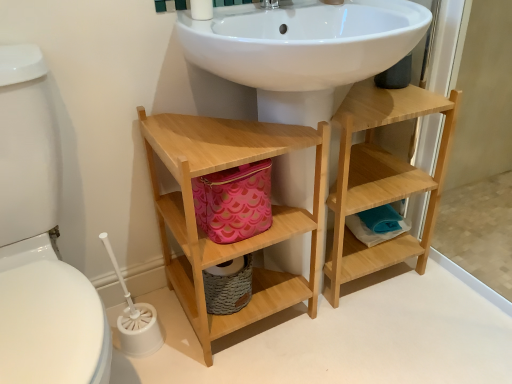
Question: In terms of width, does natural wood bathroom cabinet at lower center look wider or thinner when compared to white glossy toilet bowl at left?

Choices:
 (A) wide
 (B) thin

Answer: (B)

Question: From the image's perspective, is natural wood bathroom cabinet at lower center above or below white glossy toilet bowl at left?

Choices:
 (A) above
 (B) below

Answer: (A)

Question: Estimate the real-world distances between objects in this image. Which object is farther from the white plastic toilet brush at lower left?

Choices:
 (A) natural wood shelf at center
 (B) natural wood bathroom cabinet at lower center
 (C) white glossy toilet bowl at left

Answer: (A)

Question: Which object is the closest to the natural wood shelf at center?

Choices:
 (A) white glossy toilet bowl at left
 (B) white plastic toilet brush at lower left
 (C) natural wood bathroom cabinet at lower center

Answer: (C)